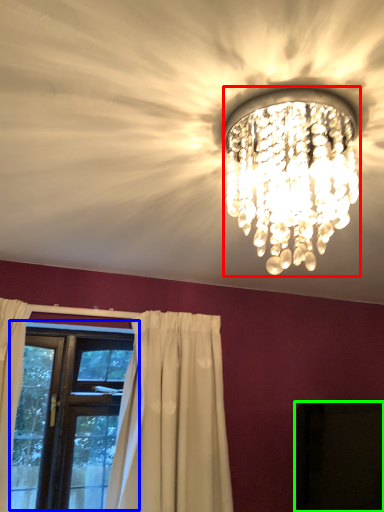
Question: Which is farther away from lamp (highlighted by a red box)? window (highlighted by a blue box) or dark (highlighted by a green box)?

Choices:
 (A) window
 (B) dark

Answer: (A)